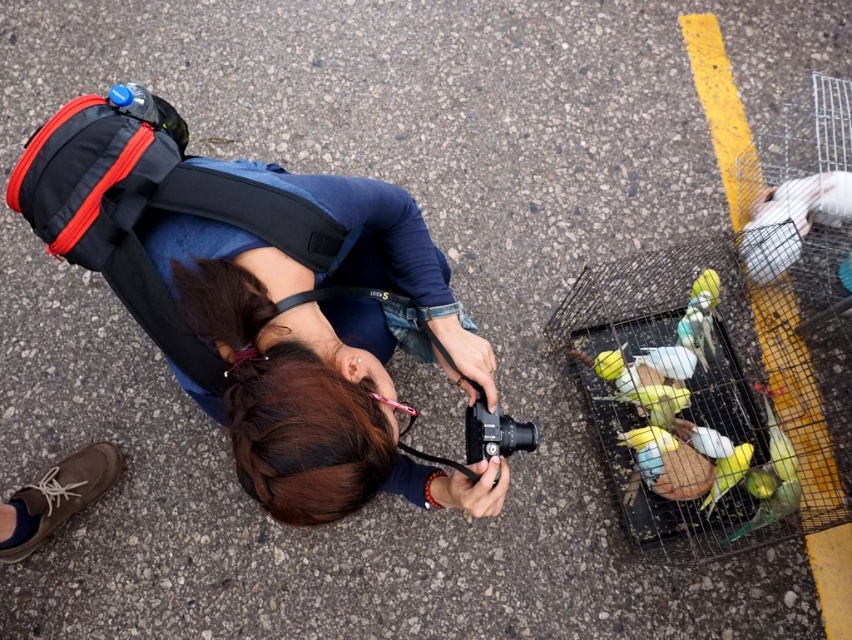
Between white matte bird at right and yellow matte parrot at lower right, which one has less height?

yellow matte parrot at lower right

Can you confirm if white matte bird at right is shorter than yellow matte parrot at lower right?

No, white matte bird at right is not shorter than yellow matte parrot at lower right.

Is point (819, 211) closer to viewer compared to point (744, 460)?

No, it is behind (744, 460).

This screenshot has height=640, width=852. I want to click on white matte bird at right, so click(792, 220).

Does matte black backpack at center have a larger size compared to white matte bird at right?

Indeed, matte black backpack at center has a larger size compared to white matte bird at right.

Which is behind, point (186, 352) or point (770, 266)?

The point (770, 266) is more distant.

Where is `matte black backpack at center`? The height and width of the screenshot is (640, 852). matte black backpack at center is located at coordinates (239, 291).

Is matte black backpack at center thinner than yellow matte parrot at lower right?

In fact, matte black backpack at center might be wider than yellow matte parrot at lower right.

Find the location of `matte black backpack at center`. matte black backpack at center is located at coordinates (239, 291).

Does point (229, 388) lie behind point (711, 506)?

That is False.

Where is `matte black backpack at center`? Image resolution: width=852 pixels, height=640 pixels. matte black backpack at center is located at coordinates (239, 291).